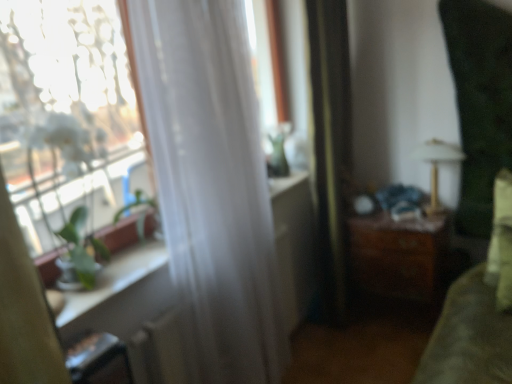
Question: Is white sheer curtain at left, positioned as the 2th curtain in right-to-left order, in front of or behind metallic gold lamp at upper right in the image?

Choices:
 (A) behind
 (B) front

Answer: (B)

Question: Based on their positions, is white sheer curtain at left, marked as the first curtain in a left-to-right arrangement, located to the left or right of metallic gold lamp at upper right?

Choices:
 (A) right
 (B) left

Answer: (B)

Question: Which is farther from the wooden chest of drawers at center-right?

Choices:
 (A) white sheer curtain at left
 (B) metallic gold lamp at upper right
 (C) white sheer curtain at left, positioned as the 2th curtain in right-to-left order
 (D) transparent glass window at left
 (E) silky black curtain at center, positioned as the second curtain in left-to-right order

Answer: (D)

Question: Which object is the farthest from the transparent glass window at left?

Choices:
 (A) white sheer curtain at left
 (B) white sheer curtain at left, positioned as the 2th curtain in right-to-left order
 (C) metallic gold lamp at upper right
 (D) wooden chest of drawers at center-right
 (E) silky black curtain at center, positioned as the second curtain in left-to-right order

Answer: (C)